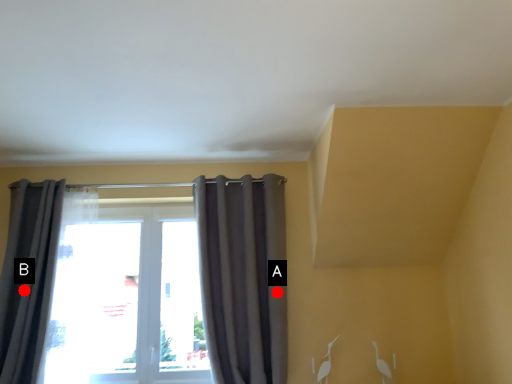
Question: Two points are circled on the image, labeled by A and B beside each circle. Which point appears farthest from the camera in this image?

Choices:
 (A) A is further
 (B) B is further

Answer: (A)